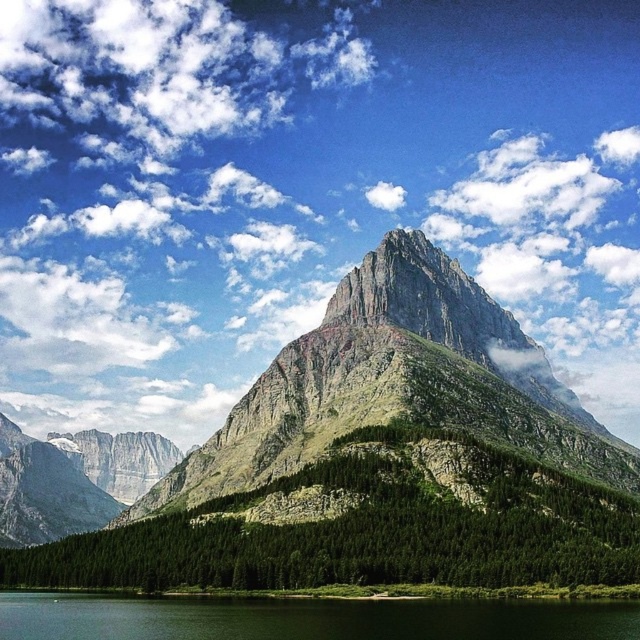
Question: Where is green grassy mountain at center located in relation to green grassy shore at lower center in the image?

Choices:
 (A) left
 (B) right

Answer: (B)

Question: Can you confirm if green grassy mountain at center is smaller than green grassy shore at lower center?

Choices:
 (A) yes
 (B) no

Answer: (B)

Question: Does green grassy mountain at center appear on the left side of green grassy shore at lower center?

Choices:
 (A) no
 (B) yes

Answer: (A)